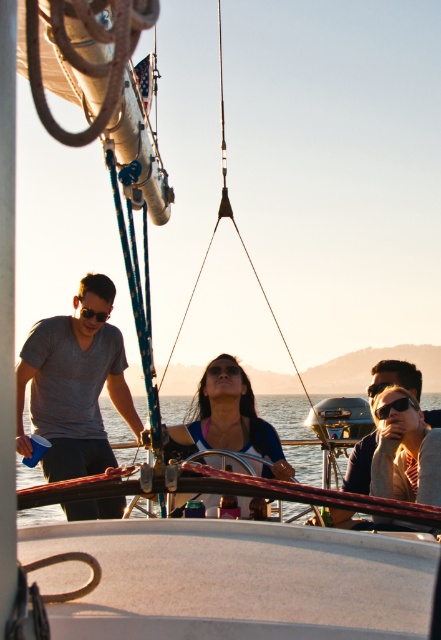
You are standing on the deck of the sailboat and notice both the matte blue shirt at center and the clear water at center. Which object is positioned more to the east? Please explain your reasoning based on the scene description.

The matte blue shirt at center is to the right of clear water at center. Since the scene is set during late afternoon or early evening with the sun casting shadows, the sun would be in the west. Shadows would stretch towards the east. If the shirt is to the right of the water, and assuming the observer faces the water towards the west, the shirt would be eastward, making it positioned more to the east.

You are a photographer on the sailboat and want to capture a photo of the clear water at center without the matte blue shirt at center blocking it. What should you do?

Since the clear water at center is behind the matte blue shirt at center, you should move the matte blue shirt at center out of the frame or adjust your position to ensure the clear water at center is visible without obstruction.

You are a swimmer who wants to jump into the water from the boat. The clear water at center and black plastic goggles at center are in your view. Which object is higher from your perspective?

The clear water at center has a greater height compared to the black plastic goggles at center, so the clear water at center is higher.